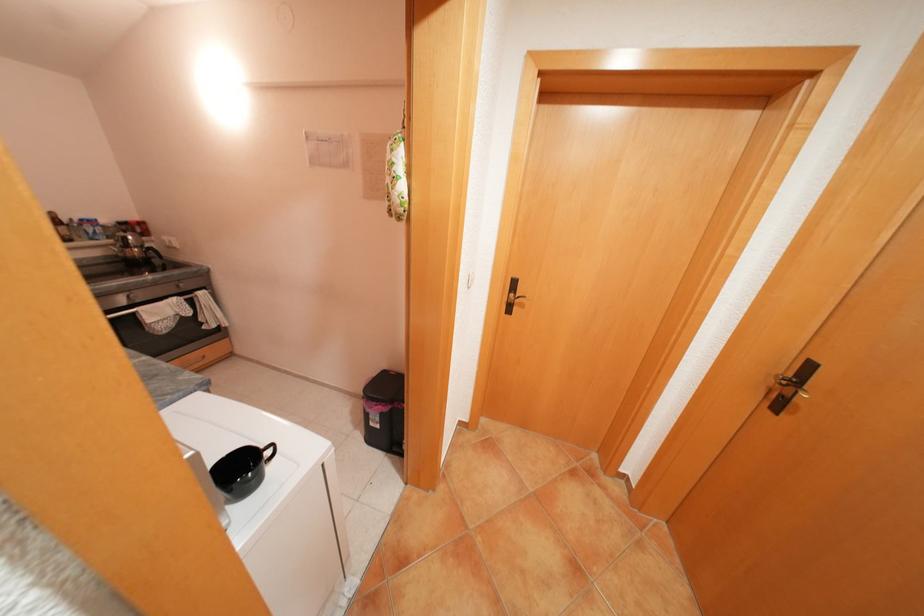
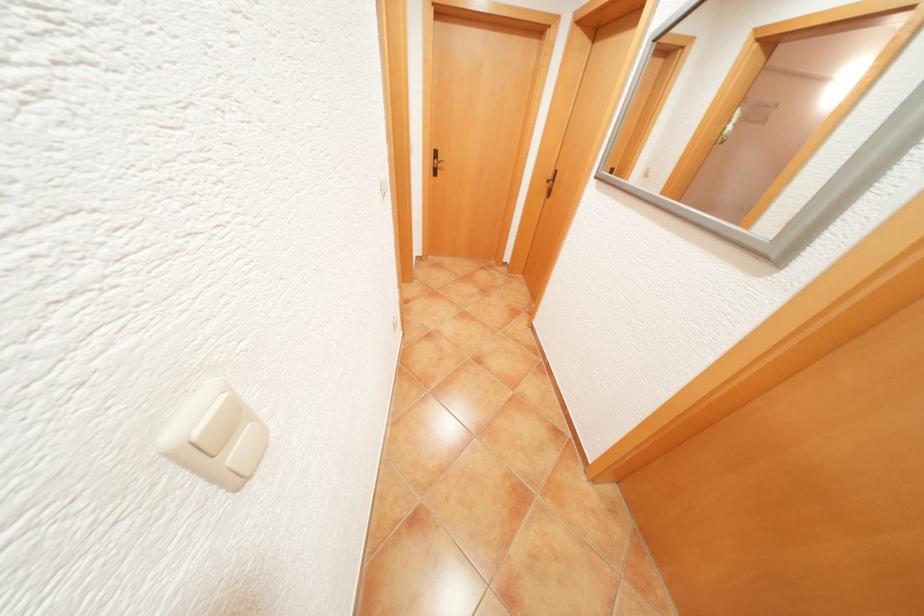
Question: I am providing you with two images of the same scene from different viewpoints. Which of the following objects are not visible in image2?

Choices:
 (A) metal kettle handle
 (B) light switch rocker
 (C) purple container
 (D) black door handle

Answer: (A)